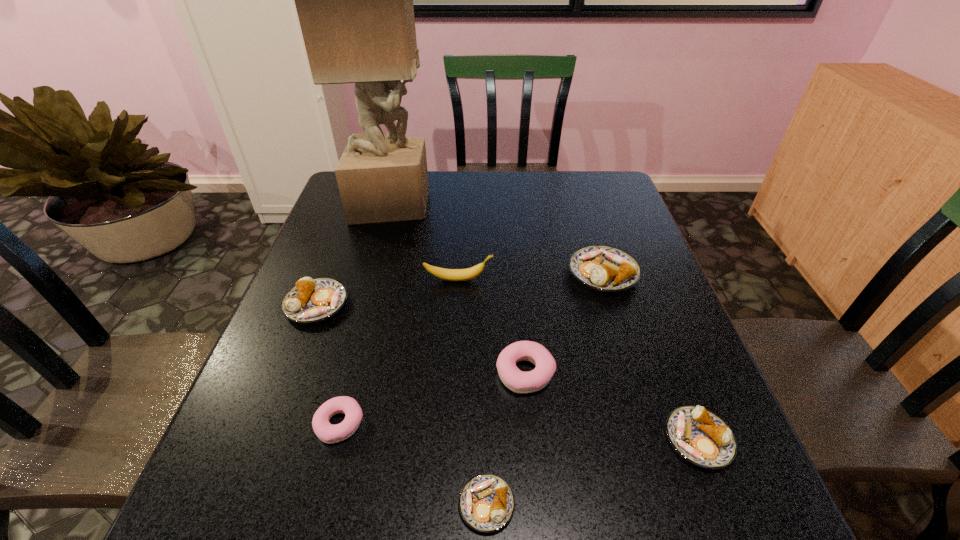
Identify the location of vacant space at the right edge of the desktop. The image size is (960, 540). (640, 382).

I want to click on vacant space at the far right corner of the desktop, so click(x=591, y=176).

Image resolution: width=960 pixels, height=540 pixels. I want to click on free space between the second smallest brown pastry and the nearest brown pastry, so click(x=592, y=472).

You are a GUI agent. You are given a task and a screenshot of the screen. Output one action in this format:
    pyautogui.click(x=<x>, y=<y>)
    Task: Click on the free point between the tallest object and the third tallest object
    
    Given the screenshot: What is the action you would take?
    pyautogui.click(x=498, y=238)

Identify the location of free spot between the third biggest brown pastry and the tallest pastry. (651, 356).

Where is `vacant space in between the nearest pastry and the tallest pastry`? vacant space in between the nearest pastry and the tallest pastry is located at coordinates (545, 389).

Find the location of a particular element. Image resolution: width=960 pixels, height=540 pixels. empty location between the yellow banana and the tallest pastry is located at coordinates (531, 276).

The height and width of the screenshot is (540, 960). In order to click on empty location between the leftmost pastry and the tallest pastry in this screenshot , I will do `click(460, 288)`.

Where is `free space between the third biggest brown pastry and the sixth shortest object`? The width and height of the screenshot is (960, 540). free space between the third biggest brown pastry and the sixth shortest object is located at coordinates (651, 356).

Where is `vacant area that lies between the leftmost brown pastry and the sculpture`? vacant area that lies between the leftmost brown pastry and the sculpture is located at coordinates (354, 254).